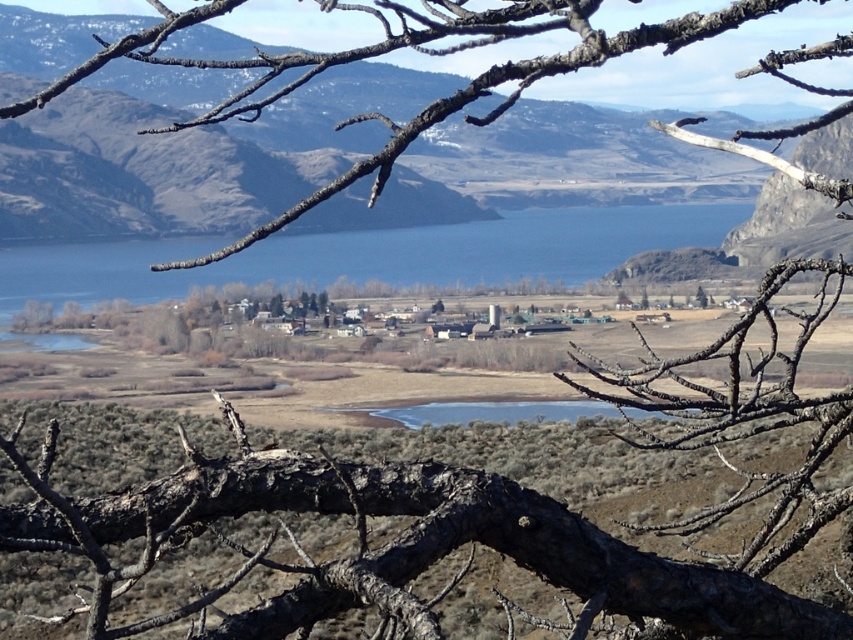
You are standing in the scenic landscape and want to take a photo of the settlement. The brown rough branch at upper center might block your view. Can you determine if the point marked by coordinates point [395,51] is part of the branch that could obstruct your view?

The point [395,51] corresponds to the brown rough branch at upper center, which is located in the foreground of the scene. Since the branch is in the foreground, it could potentially obstruct your view of the settlement in the midground.

You are an engineer designing a bridge that needs to span the gap between the dark brown bark at center and the clear water at center. The bridge must be exactly 15 meters long. Will the bridge fit perfectly between them?

The distance between dark brown bark at center and clear water at center is 14.99 meters, so the bridge at exactly 15 meters is slightly too long and will not fit perfectly between them.

You are standing in the scenic landscape and want to walk from the point at coordinates point (x=405, y=141) to the point at coordinates point (x=419, y=410). Which direction should you face to walk towards the second point?

Point (x=405, y=141) is in front of point (x=419, y=410), so you should face away from the settlement to walk towards the second point.